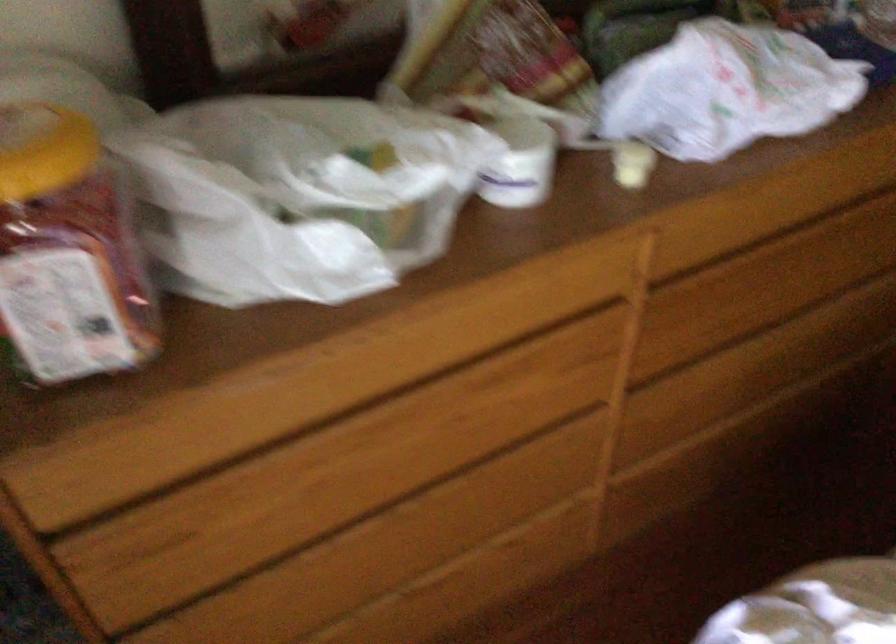
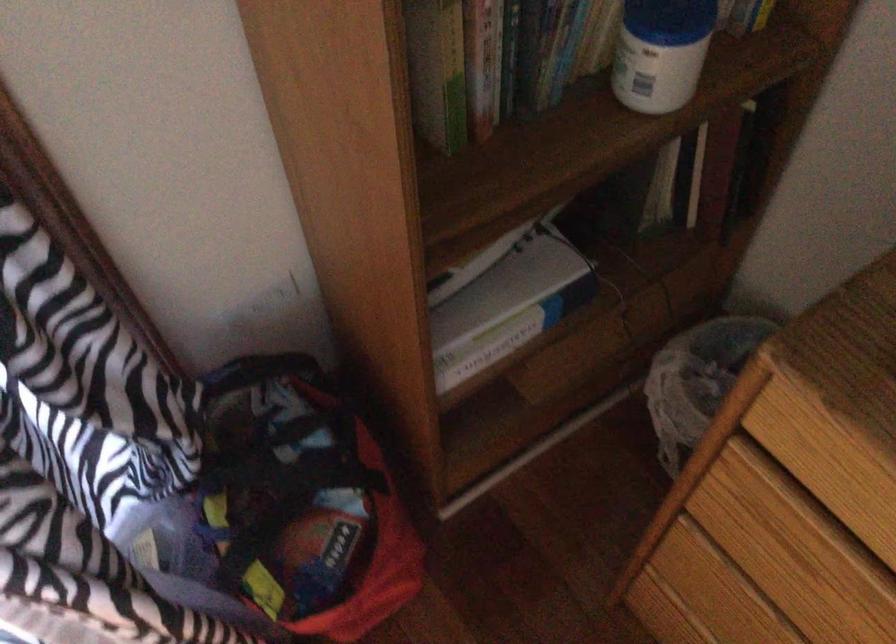
In the second image, find the point that corresponds to point (151, 538) in the first image.

(780, 526)